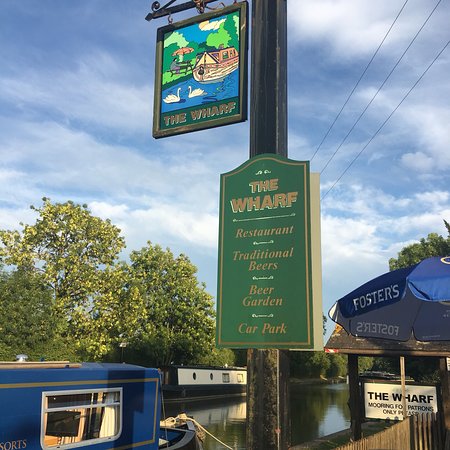
This screenshot has height=450, width=450. In order to click on circle windows in this screenshot , I will do `click(195, 375)`, `click(211, 377)`.